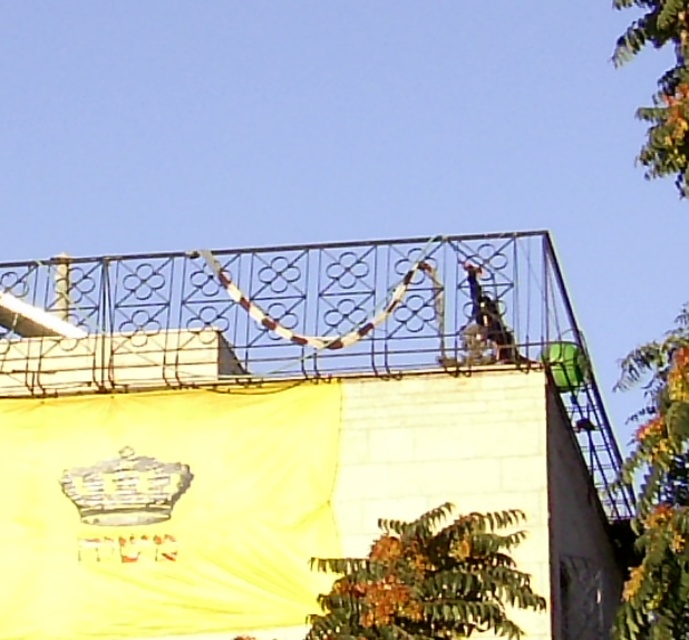
Question: Which point is farther to the camera?

Choices:
 (A) metallic helmet at upper right
 (B) metallic railing at upper center

Answer: (A)

Question: Can you confirm if metallic railing at upper center is positioned above metallic helmet at upper right?

Choices:
 (A) yes
 (B) no

Answer: (A)

Question: Is metallic railing at upper center below metallic helmet at upper right?

Choices:
 (A) yes
 (B) no

Answer: (B)

Question: Can you confirm if metallic railing at upper center is positioned below metallic helmet at upper right?

Choices:
 (A) yes
 (B) no

Answer: (B)